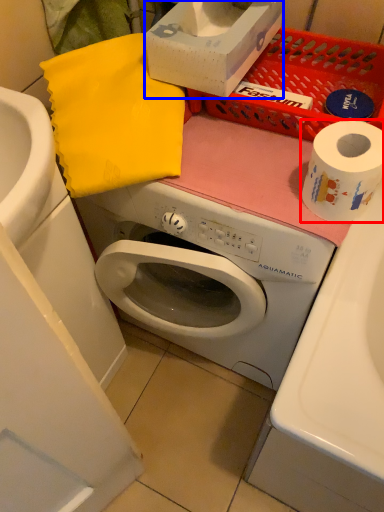
Question: Among these objects, which one is farthest to the camera, toilet paper (highlighted by a red box) or box (highlighted by a blue box)?

Choices:
 (A) toilet paper
 (B) box

Answer: (B)